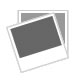
The image size is (80, 80). Identify the location of area to left of pictures. (9, 17).